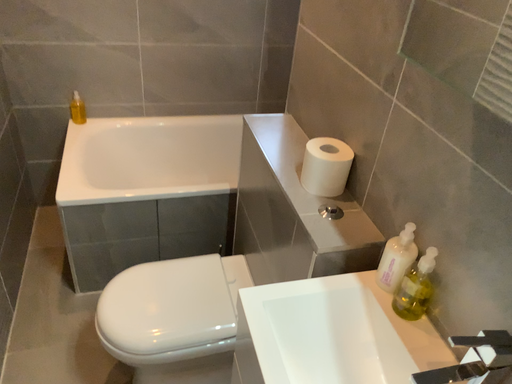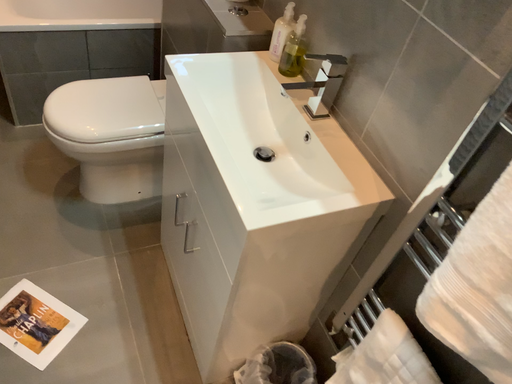
Question: Which way did the camera rotate in the video?

Choices:
 (A) rotated downward
 (B) rotated upward

Answer: (A)